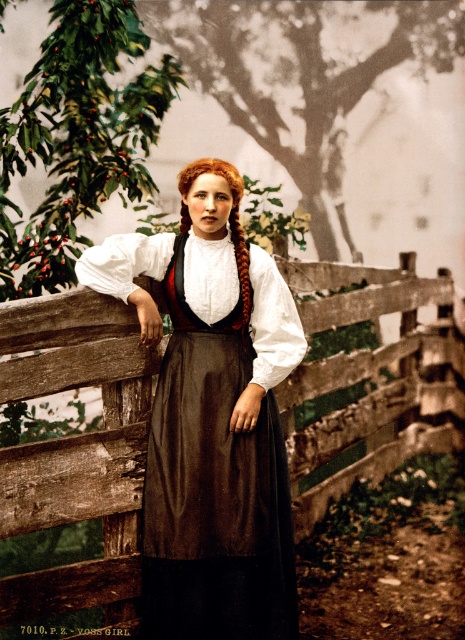
Question: Which point is closer to the camera taking this photo?

Choices:
 (A) (126, 262)
 (B) (111, 400)

Answer: (A)

Question: Considering the relative positions of wooden fence at center and brown satin dress at center in the image provided, where is wooden fence at center located with respect to brown satin dress at center?

Choices:
 (A) right
 (B) left

Answer: (A)

Question: Does wooden fence at center lie in front of brown satin dress at center?

Choices:
 (A) yes
 (B) no

Answer: (B)

Question: In this image, where is wooden fence at center located relative to brown satin dress at center?

Choices:
 (A) right
 (B) left

Answer: (A)